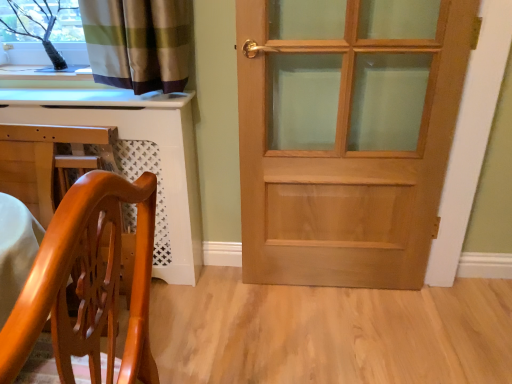
Based on the photo, what is the approximate height of light brown wooden door at center?

light brown wooden door at center is 3.72 feet in height.

Measure the distance between point (x=411, y=129) and camera.

The depth of point (x=411, y=129) is 5.37 feet.

Image resolution: width=512 pixels, height=384 pixels. I want to click on glossy wood chair at lower left, so click(88, 283).

The image size is (512, 384). Find the location of `white glossy computer desk at lower left`. white glossy computer desk at lower left is located at coordinates (135, 156).

Does white glossy computer desk at lower left appear on the right side of light brown wooden door at center?

No, white glossy computer desk at lower left is not to the right of light brown wooden door at center.

Considering the relative sizes of white glossy computer desk at lower left and light brown wooden door at center in the image provided, is white glossy computer desk at lower left smaller than light brown wooden door at center?

No.

Is white glossy computer desk at lower left looking in the opposite direction of light brown wooden door at center?

No.

Based on the photo, which is closer to the camera, (175, 101) or (468, 34)?

The point (468, 34) is closer.

Do you think glossy wood chair at lower left is within light brown wooden door at center, or outside of it?

glossy wood chair at lower left is not inside light brown wooden door at center, it's outside.

From the image's perspective, is glossy wood chair at lower left positioned above or below light brown wooden door at center?

Clearly, from the image's perspective, glossy wood chair at lower left is below light brown wooden door at center.

Is glossy wood chair at lower left at the right side of light brown wooden door at center?

Incorrect, glossy wood chair at lower left is not on the right side of light brown wooden door at center.

From the picture: Which of these two, glossy wood chair at lower left or light brown wooden door at center, is wider?

With larger width is glossy wood chair at lower left.

How much distance is there between white glossy computer desk at lower left and glossy wood chair at lower left?

91.55 centimeters.

Are white glossy computer desk at lower left and glossy wood chair at lower left making contact?

No, white glossy computer desk at lower left is not beside glossy wood chair at lower left.

Is white glossy computer desk at lower left facing towards glossy wood chair at lower left?

Yes, white glossy computer desk at lower left is aimed at glossy wood chair at lower left.

Is white glossy computer desk at lower left positioned beyond the bounds of glossy wood chair at lower left?

Yes, white glossy computer desk at lower left is located beyond the bounds of glossy wood chair at lower left.

From their relative heights in the image, would you say light brown wooden door at center is taller or shorter than white glossy computer desk at lower left?

light brown wooden door at center is taller than white glossy computer desk at lower left.

Does light brown wooden door at center come behind white glossy computer desk at lower left?

No, it is not.

From a real-world perspective, relative to white glossy computer desk at lower left, is light brown wooden door at center vertically above or below?

light brown wooden door at center is situated higher than white glossy computer desk at lower left in the real world.

Which is more to the left, light brown wooden door at center or white glossy computer desk at lower left?

white glossy computer desk at lower left is more to the left.

This screenshot has height=384, width=512. Find the location of `chair lying in front of the white glossy computer desk at lower left`. chair lying in front of the white glossy computer desk at lower left is located at coordinates 88,283.

In the scene shown: How far apart are glossy wood chair at lower left and white glossy computer desk at lower left?

glossy wood chair at lower left is 36.04 inches from white glossy computer desk at lower left.

From the image's perspective, is glossy wood chair at lower left on top of white glossy computer desk at lower left?

No, from the image's perspective, glossy wood chair at lower left is not on top of white glossy computer desk at lower left.

Are glossy wood chair at lower left and white glossy computer desk at lower left far apart?

glossy wood chair at lower left is actually quite close to white glossy computer desk at lower left.

From the image's perspective, does light brown wooden door at center appear higher than glossy wood chair at lower left?

Indeed, from the image's perspective, light brown wooden door at center is shown above glossy wood chair at lower left.

Find the location of a particular element. The image size is (512, 384). chair on the left of the light brown wooden door at center is located at coordinates (88, 283).

Locate an element on the screen. computer desk that is under the light brown wooden door at center (from a real-world perspective) is located at coordinates (135, 156).

Where is `door to the right of glossy wood chair at lower left`? door to the right of glossy wood chair at lower left is located at coordinates [346, 136].

Looking at the image, which one is located further to white glossy computer desk at lower left, light brown wooden door at center or glossy wood chair at lower left?

The object further to white glossy computer desk at lower left is glossy wood chair at lower left.

Which object lies further to the anchor point glossy wood chair at lower left, white glossy computer desk at lower left or light brown wooden door at center?

light brown wooden door at center is positioned further to the anchor glossy wood chair at lower left.

From the image, which object appears to be farther from white glossy computer desk at lower left, glossy wood chair at lower left or light brown wooden door at center?

glossy wood chair at lower left is positioned further to the anchor white glossy computer desk at lower left.

Estimate the real-world distances between objects in this image. Which object is closer to light brown wooden door at center, white glossy computer desk at lower left or glossy wood chair at lower left?

white glossy computer desk at lower left is positioned closer to the anchor light brown wooden door at center.

Estimate the real-world distances between objects in this image. Which object is further from glossy wood chair at lower left, light brown wooden door at center or white glossy computer desk at lower left?

Among the two, light brown wooden door at center is located further to glossy wood chair at lower left.

Considering their positions, is glossy wood chair at lower left positioned further to light brown wooden door at center than white glossy computer desk at lower left?

glossy wood chair at lower left is positioned further to the anchor light brown wooden door at center.

Locate an element on the screen. This screenshot has width=512, height=384. door between glossy wood chair at lower left and white glossy computer desk at lower left from front to back is located at coordinates (346, 136).